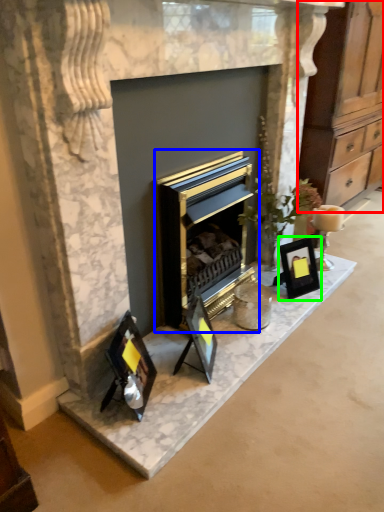
Question: Estimate the real-world distances between objects in this image. Which object is farther from dresser (highlighted by a red box), fireplace (highlighted by a blue box) or picture frame (highlighted by a green box)?

Choices:
 (A) fireplace
 (B) picture frame

Answer: (A)